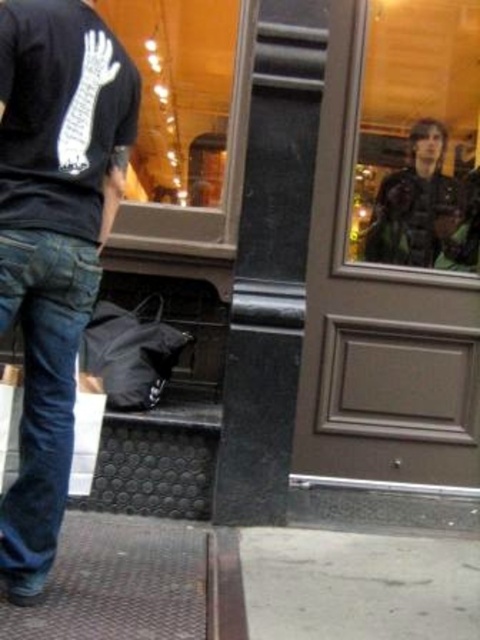
You are a delivery person holding a package that requires a 36 inch clearance to maneuver safely. You need to pass between the denim at left and the clear glass door at center. Can you safely navigate through this space with your package?

The denim at left and the clear glass door at center are 36.44 inches apart from each other. Since the required clearance is 36 inches, the 36.44 inches space provides enough room for the delivery person to safely maneuver the package through.

You are a delivery person who needs to hand over a package to the person standing on the sidewalk. You have a large box that is 1.5 meters tall. Can you carry the box past the dark brown leather jacket at upper right and the clear glass door at center without tilting it sideways?

The dark brown leather jacket at upper right is shorter than the clear glass door at center. Since the box is 1.5 meters tall, it might not fit under the jacket but could pass through the door. However, since the jacket is shorter than the door, the box would hit the jacket first. Therefore, you cannot carry the box past both without tilting it sideways.

You are a delivery person who needs to hand over a package to the person standing on the sidewalk. The package is too large to carry in your arms. You have to place it on the ground near the dark brown leather jacket at upper right and the clear glass door at center. Which object should you place it closer to if you want to ensure it is near the smaller one?

The dark brown leather jacket at upper right is smaller than the clear glass door at center, so you should place the package closer to the dark brown leather jacket at upper right to ensure it is near the smaller object.